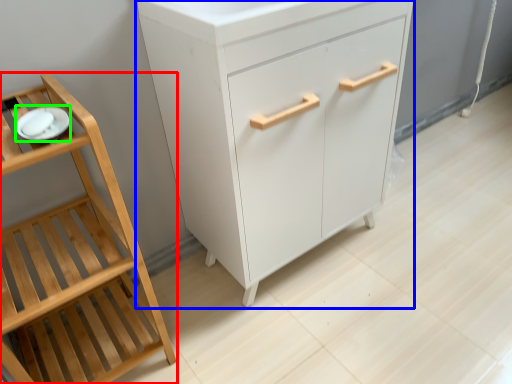
Question: Which object is the farthest from furniture (highlighted by a red box)? Choose among these: chest of drawers (highlighted by a blue box) or tableware (highlighted by a green box).

Choices:
 (A) chest of drawers
 (B) tableware

Answer: (A)